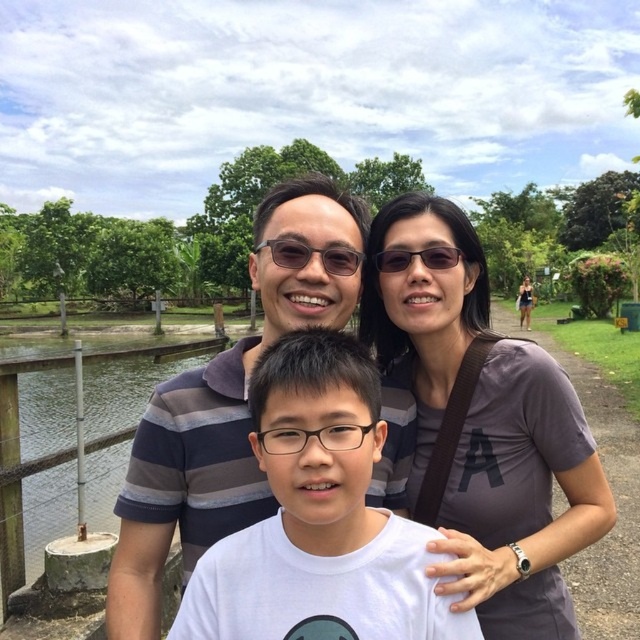
Does gray fabric shirt at upper center appear on the right side of matte black sunglasses at center?

Indeed, gray fabric shirt at upper center is positioned on the right side of matte black sunglasses at center.

Between point (588, 470) and point (275, 237), which one is positioned behind?

Positioned behind is point (588, 470).

Find the location of `gray fabric shirt at upper center`. gray fabric shirt at upper center is located at coordinates (483, 428).

Does striped cotton shirt at center have a greater height compared to matte black glasses at center?

Yes, striped cotton shirt at center is taller than matte black glasses at center.

Can you confirm if striped cotton shirt at center is wider than matte black glasses at center?

Yes, striped cotton shirt at center is wider than matte black glasses at center.

You are a GUI agent. You are given a task and a screenshot of the screen. Output one action in this format:
    pyautogui.click(x=<x>, y=<y>)
    Task: Click on the striped cotton shirt at center
    
    Given the screenshot: What is the action you would take?
    pyautogui.click(x=205, y=449)

At what (x,y) coordinates should I click in order to perform the action: click on striped cotton shirt at center. Please return your answer as a coordinate pair (x, y). This screenshot has height=640, width=640. Looking at the image, I should click on coord(205,449).

Is the position of gray fabric shirt at upper center less distant than that of white matte shirt at center?

No, it is not.

Does gray fabric shirt at upper center appear over white matte shirt at center?

Yes.

Image resolution: width=640 pixels, height=640 pixels. Describe the element at coordinates (483, 428) in the screenshot. I see `gray fabric shirt at upper center` at that location.

Find the location of a particular element. The height and width of the screenshot is (640, 640). gray fabric shirt at upper center is located at coordinates (483, 428).